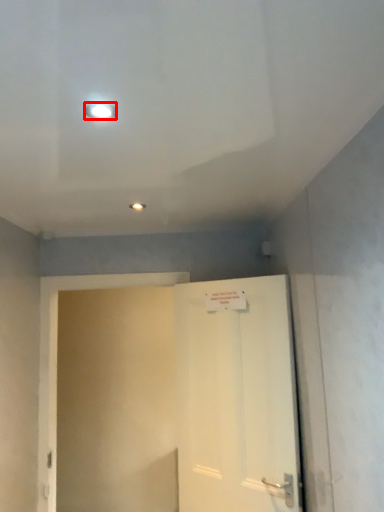
Question: From the image's perspective, considering the relative positions of lighting (annotated by the red box) and door in the image provided, where is lighting (annotated by the red box) located with respect to the staircase?

Choices:
 (A) above
 (B) below

Answer: (A)